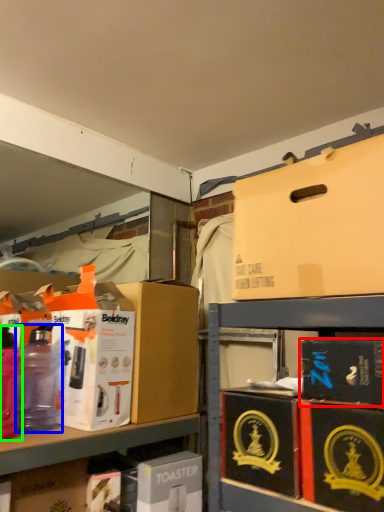
Question: Which object is positioned closest to box (highlighted by a red box)? Select from bottle (highlighted by a blue box) and bottle (highlighted by a green box).

Choices:
 (A) bottle
 (B) bottle

Answer: (A)